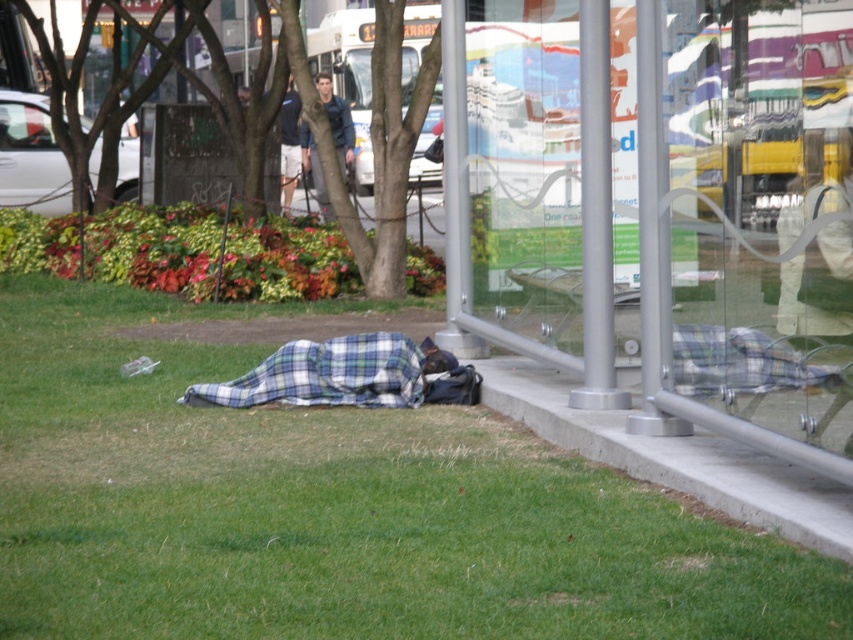
Which is more to the left, concrete at lower right or dark blue shirt at center?

From the viewer's perspective, dark blue shirt at center appears more on the left side.

Is concrete at lower right bigger than dark blue shirt at center?

Actually, concrete at lower right might be smaller than dark blue shirt at center.

Describe the element at coordinates (676, 458) in the screenshot. I see `concrete at lower right` at that location.

This screenshot has width=853, height=640. What are the coordinates of `concrete at lower right` in the screenshot? It's located at (676, 458).

Who is more distant from viewer, (321, 93) or (293, 164)?

The point (293, 164) is more distant.

Between point (343, 168) and point (281, 116), which one is positioned behind?

The point (281, 116) is behind.

Locate an element on the screen. This screenshot has width=853, height=640. blue denim jacket at upper center is located at coordinates (335, 120).

Which is above, green grass at lower left or plaid fabric blanket at lower center?

Positioned higher is plaid fabric blanket at lower center.

Does point (276, 408) come in front of point (415, 355)?

Yes, it is in front of point (415, 355).

Identify the location of green grass at lower left. The image size is (853, 640). (334, 509).